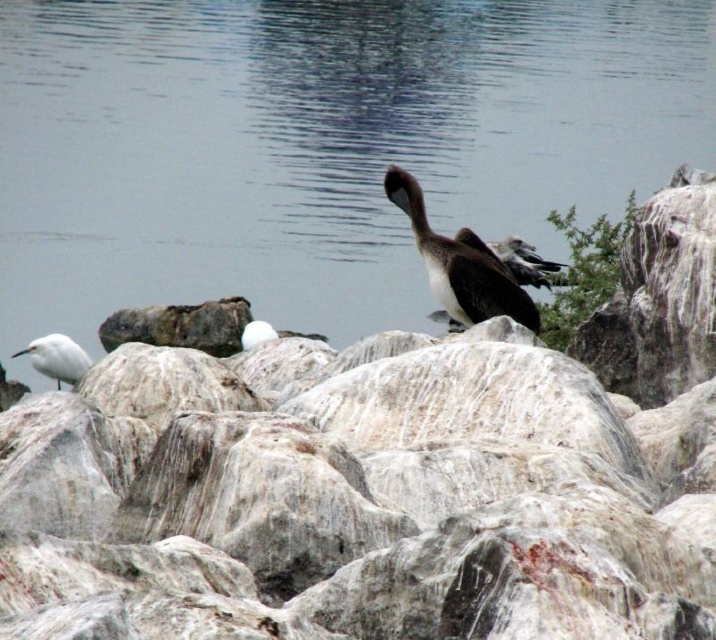
Who is higher up, smooth gray rock at center or smooth gray water at center?

smooth gray water at center is above.

Is point (231, 481) positioned after point (606, 106)?

No, it is not.

You are a GUI agent. You are given a task and a screenshot of the screen. Output one action in this format:
    pyautogui.click(x=<x>, y=<y>)
    Task: Click on the smooth gray rock at center
    
    Given the screenshot: What is the action you would take?
    pyautogui.click(x=382, y=481)

Is smooth gray water at center to the left of white matte bird at left from the viewer's perspective?

Correct, you'll find smooth gray water at center to the left of white matte bird at left.

Is smooth gray water at center positioned at the back of white matte bird at left?

Yes.

Is point (589, 65) positioned in front of point (64, 364)?

No, (589, 65) is further to viewer.

Identify the location of smooth gray water at center. click(319, 145).

From the picture: Does white matte bird at left have a larger size compared to white feathered bird at center?

No.

Can you confirm if white matte bird at left is thinner than white feathered bird at center?

Indeed, white matte bird at left has a lesser width compared to white feathered bird at center.

Which is behind, point (62, 342) or point (488, 246)?

The point (488, 246) is more distant.

This screenshot has width=716, height=640. Find the location of `white matte bird at left`. white matte bird at left is located at coordinates (57, 358).